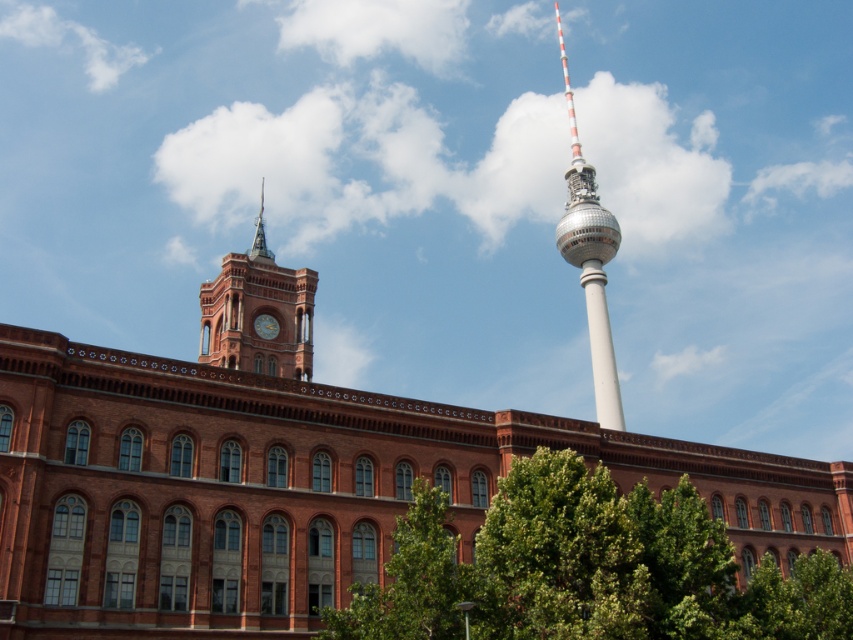
You are standing in front of the historic red brick building and want to take a photo of the shiny silver spire at upper left. Your camera has a maximum zoom range of 50 meters. Can you capture the spire in your photo without moving closer?

The shiny silver spire at upper left is 69.91 meters away from the camera. Since your camera can only zoom up to 50 meters, you cannot capture the spire in your photo without moving closer.

You are a tourist in Berlin and want to take a photo that includes both the white glossy tower at center and the shiny silver spire at upper left. Based on their heights, which one should you position closer to the bottom of your camera frame?

The white glossy tower at center is taller than the shiny silver spire at upper left, so to include both in the photo, position the white glossy tower at center closer to the bottom of the frame to accommodate its greater height.

You are standing in front of the historic Red Town Hall and the Fernsehturm. You notice two points marked on the image at coordinates point (253,356) and point (253,257). If you want to take a closer look at one of these points first, which one would you physically move towards to get nearer without changing your position relative to the buildings?

You should move towards point (253,356) because it is closer to the camera compared to point (253,257), meaning it is physically nearer to your current position.